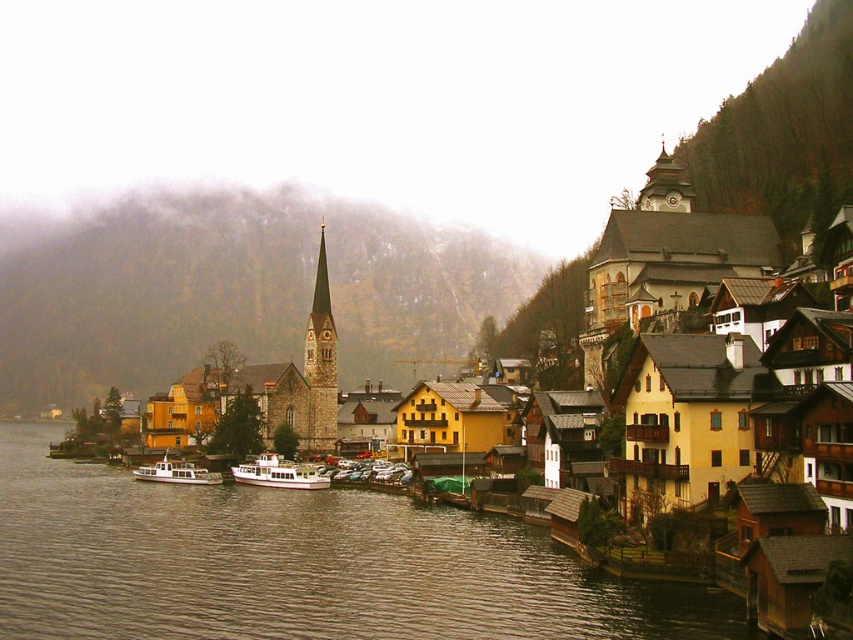
You are an architect designing a new building that must be wider than the smooth stone spire at center. Can the white glossy boat at center be used as a reference for the minimum width requirement? Please explain using the given information.

The smooth stone spire at center has a lesser width compared to the white glossy boat at center. Therefore, the white glossy boat at center can be used as a reference for the minimum width requirement since it is wider than the spire.

You are an architect planning to build a new structure in the village. The village council requires that any new building must not exceed the size of the largest existing structure. Which of the two objects, the smooth stone spire at center or the white glossy boat at center, should you use as a reference for the maximum allowed size?

The smooth stone spire at center is bigger than the white glossy boat at center, so you should use the smooth stone spire at center as the reference for the maximum allowed size.